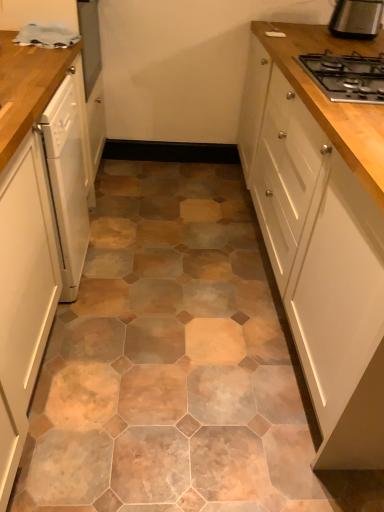
Question: Is white glossy cabinet at left, the first cabinetry viewed from the left, wider than white glossy cabinet at upper right, marked as the first cabinetry in a right-to-left arrangement?

Choices:
 (A) no
 (B) yes

Answer: (A)

Question: Considering the relative sizes of white glossy cabinet at left, the first cabinetry viewed from the left, and white glossy cabinet at upper right, which is the 2th cabinetry from left to right, in the image provided, is white glossy cabinet at left, the first cabinetry viewed from the left, bigger than white glossy cabinet at upper right, which is the 2th cabinetry from left to right,?

Choices:
 (A) yes
 (B) no

Answer: (B)

Question: From a real-world perspective, is white glossy cabinet at left, the 2th cabinetry positioned from the right, located beneath white glossy cabinet at upper right, marked as the first cabinetry in a right-to-left arrangement?

Choices:
 (A) yes
 (B) no

Answer: (A)

Question: Is white glossy cabinet at left, the first cabinetry viewed from the left, further to the viewer compared to white glossy cabinet at upper right, marked as the first cabinetry in a right-to-left arrangement?

Choices:
 (A) no
 (B) yes

Answer: (A)

Question: Can you see white glossy cabinet at left, the first cabinetry viewed from the left, touching white glossy cabinet at upper right, which is the 2th cabinetry from left to right?

Choices:
 (A) no
 (B) yes

Answer: (A)

Question: Is point (334, 221) closer or farther from the camera than point (82, 141)?

Choices:
 (A) closer
 (B) farther

Answer: (A)

Question: From a real-world perspective, is white glossy cabinet at upper right, marked as the first cabinetry in a right-to-left arrangement, positioned above or below white glossy dishwasher at left?

Choices:
 (A) below
 (B) above

Answer: (B)

Question: Based on their sizes in the image, would you say white glossy cabinet at upper right, which is the 2th cabinetry from left to right, is bigger or smaller than white glossy dishwasher at left?

Choices:
 (A) small
 (B) big

Answer: (B)

Question: Would you say white glossy cabinet at upper right, marked as the first cabinetry in a right-to-left arrangement, is to the left or to the right of white glossy dishwasher at left in the picture?

Choices:
 (A) right
 (B) left

Answer: (A)

Question: Considering the positions of white glossy cabinet at upper right, marked as the first cabinetry in a right-to-left arrangement, and black metal gas stove at upper right in the image, is white glossy cabinet at upper right, marked as the first cabinetry in a right-to-left arrangement, bigger or smaller than black metal gas stove at upper right?

Choices:
 (A) big
 (B) small

Answer: (A)

Question: Considering the positions of point (347, 254) and point (332, 69), is point (347, 254) closer or farther from the camera than point (332, 69)?

Choices:
 (A) farther
 (B) closer

Answer: (B)

Question: From a real-world perspective, is white glossy cabinet at upper right, which is the 2th cabinetry from left to right, above or below black metal gas stove at upper right?

Choices:
 (A) below
 (B) above

Answer: (A)

Question: Is white glossy cabinet at upper right, marked as the first cabinetry in a right-to-left arrangement, situated inside black metal gas stove at upper right or outside?

Choices:
 (A) inside
 (B) outside

Answer: (B)

Question: In terms of height, does black metal gas stove at upper right look taller or shorter compared to black metallic toaster at upper right?

Choices:
 (A) tall
 (B) short

Answer: (B)

Question: Considering the positions of black metal gas stove at upper right and black metallic toaster at upper right in the image, is black metal gas stove at upper right bigger or smaller than black metallic toaster at upper right?

Choices:
 (A) big
 (B) small

Answer: (A)